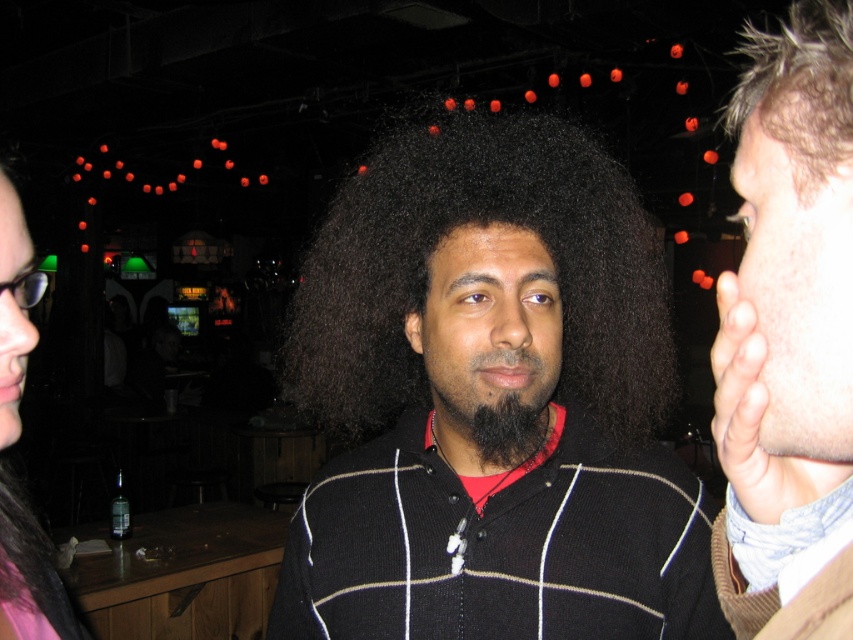
In the image, there is a man with a large afro hairstyle wearing a black sweater with white horizontal stripes and a red shirt underneath. His face has smooth skin at right. Where exactly is the smooth skin face at right located in the image?

The smooth skin face at right is located at the 2D coordinates point (788, 337) in the image.

In the scene, you see a black matte beard at center and a matte black hair at left. Which of these two objects is positioned more to the right side of the image?

The black matte beard at center is positioned to the right of the matte black hair at left, so the black matte beard at center is more to the right.